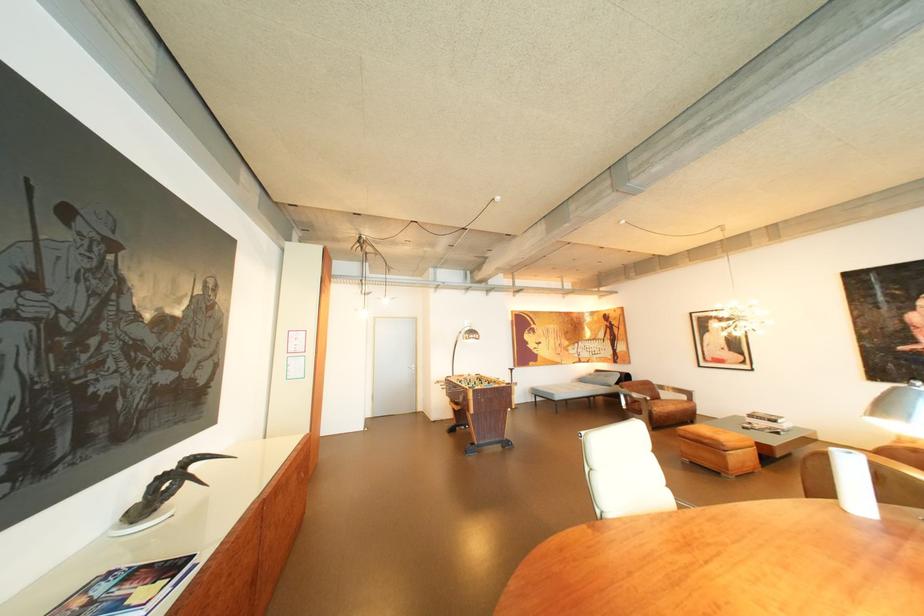
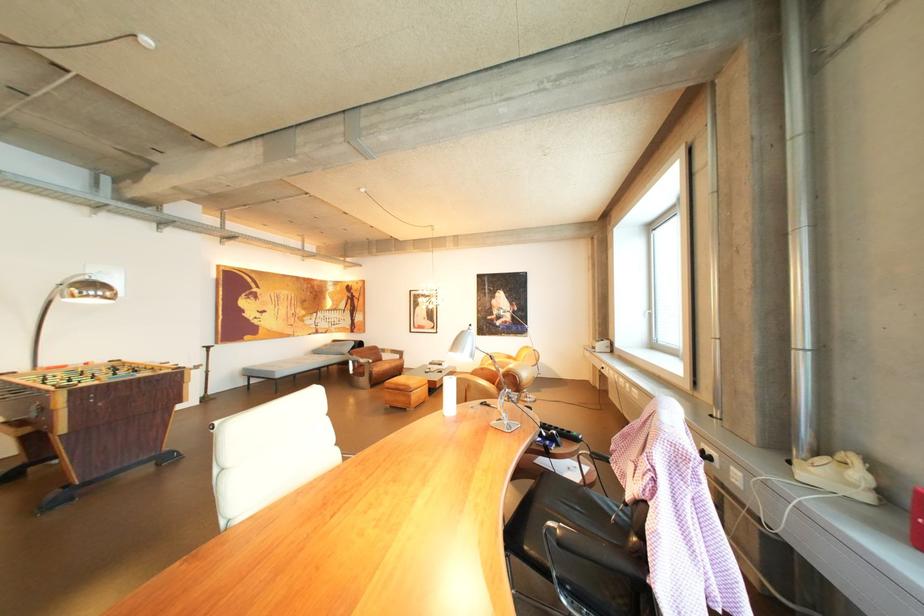
Question: Based on the continuous images, in which direction is the camera rotating? Reply with the corresponding letter.

Choices:
 (A) Left
 (B) Right
 (C) Up
 (D) Down

Answer: (B)